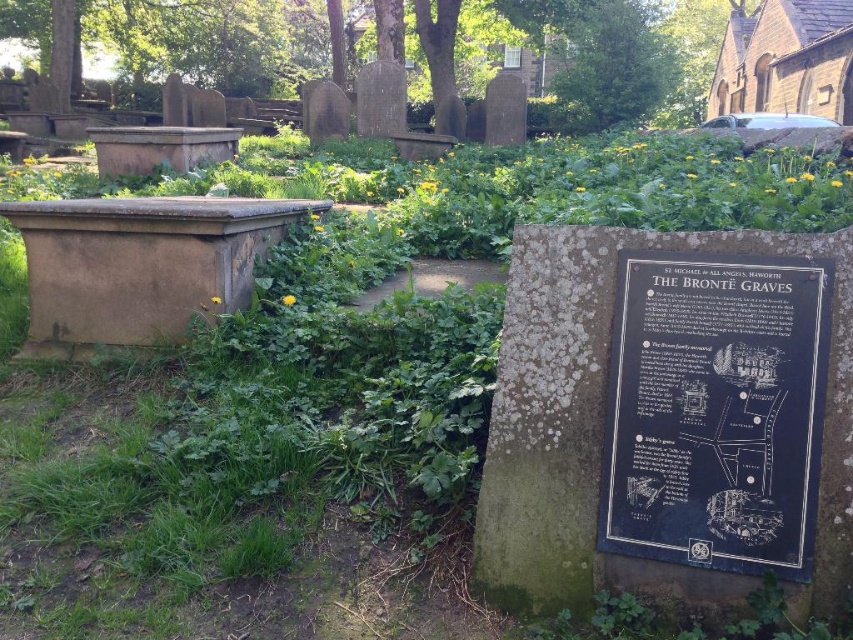
Question: Which of the following is the closest to the observer?

Choices:
 (A) (228, 196)
 (B) (801, 573)

Answer: (B)

Question: Is black polished stone plaque at center above brown stone sarcophagus at left?

Choices:
 (A) no
 (B) yes

Answer: (A)

Question: Does black polished stone plaque at center have a greater width compared to brown stone sarcophagus at left?

Choices:
 (A) yes
 (B) no

Answer: (B)

Question: Is black polished stone plaque at center closer to the viewer compared to brown stone sarcophagus at left?

Choices:
 (A) no
 (B) yes

Answer: (B)